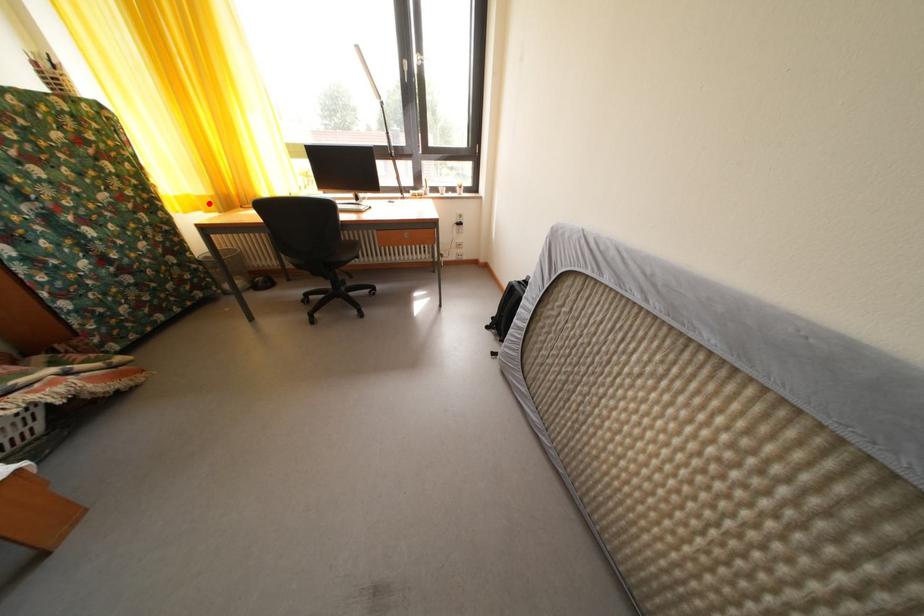
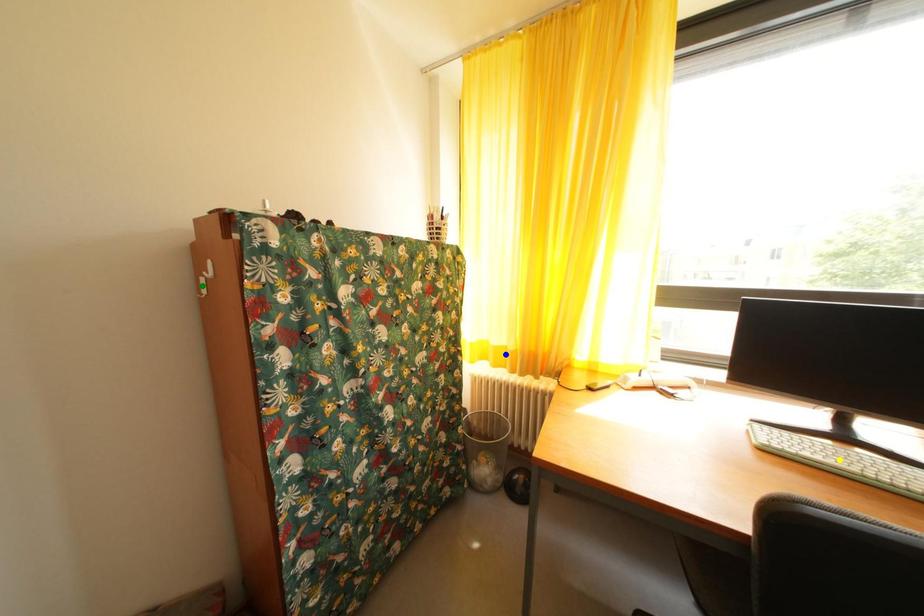
Question: I am providing you with two images of the same scene from different viewpoints. A red point is marked on the first image. You are given multiple points on the second image. Which point in image 2 is actually the same real-world point as the red point in image 1?

Choices:
 (A) blue point
 (B) green point
 (C) yellow point

Answer: (A)